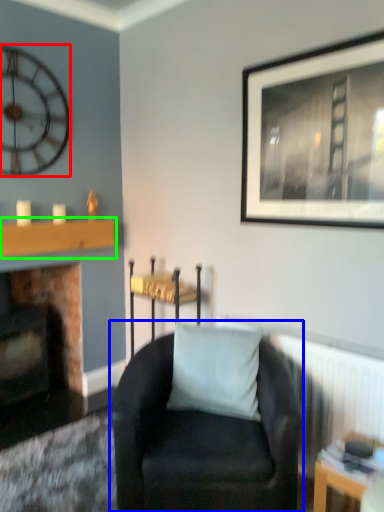
Question: Based on their relative distances, which object is nearer to wall clock (highlighted by a red box)? Choose from chair (highlighted by a blue box) and mantle (highlighted by a green box).

Choices:
 (A) chair
 (B) mantle

Answer: (B)